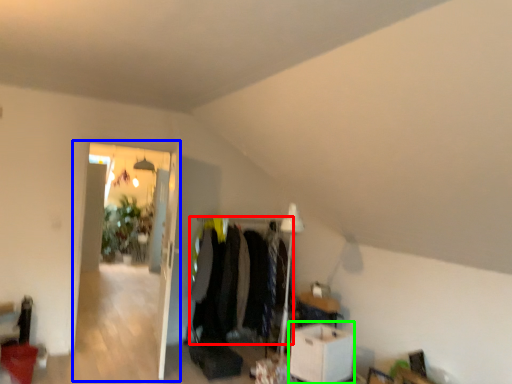
Question: Which object is the closest to the clothing (highlighted by a red box)? Choose among these: glass door (highlighted by a blue box) or table (highlighted by a green box).

Choices:
 (A) glass door
 (B) table

Answer: (B)